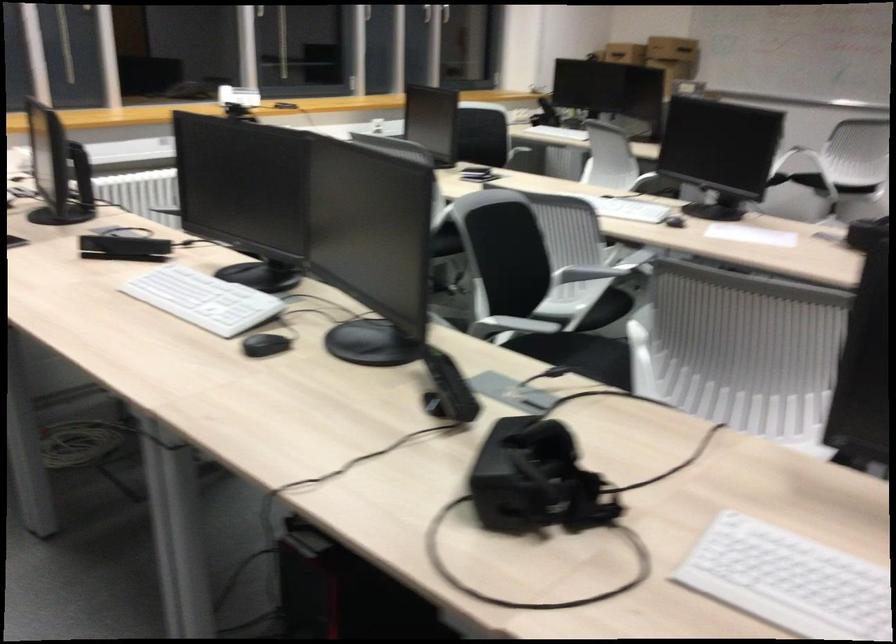
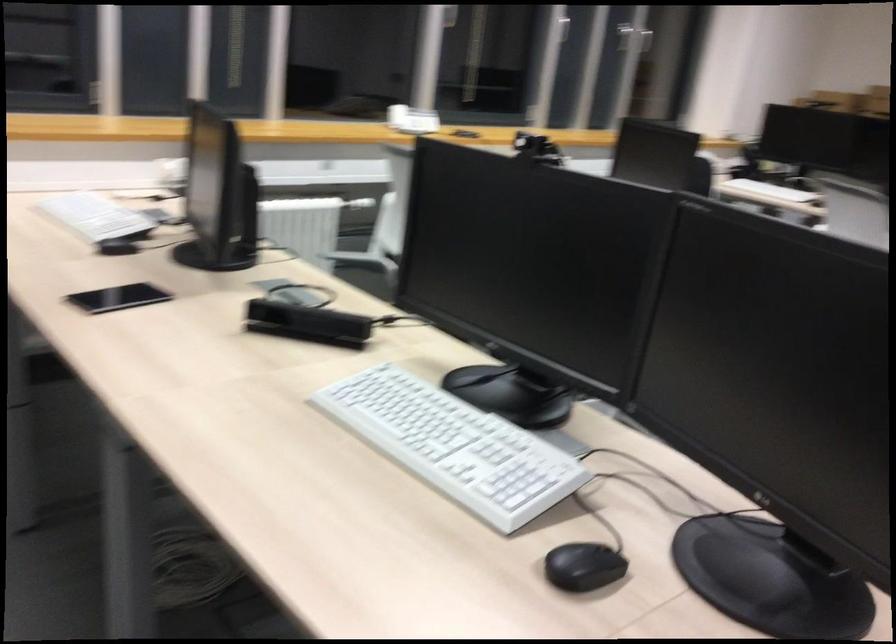
In a continuous first-person perspective shot, in which direction is the camera moving?

The movement direction of the cameraman is left, forward.